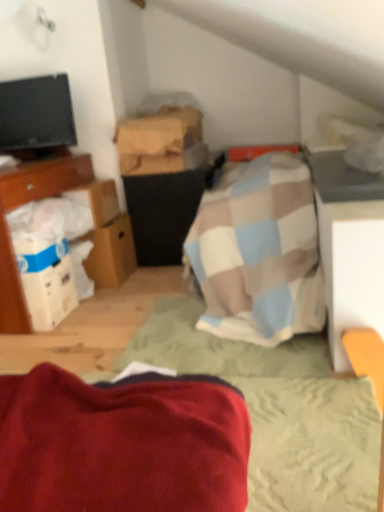
Question: Is white cardboard box at left with black glossy tv at upper left?

Choices:
 (A) yes
 (B) no

Answer: (B)

Question: Does white cardboard box at left have a larger size compared to black glossy tv at upper left?

Choices:
 (A) no
 (B) yes

Answer: (A)

Question: From a real-world perspective, is white cardboard box at left below black glossy tv at upper left?

Choices:
 (A) yes
 (B) no

Answer: (A)

Question: Considering the relative positions of white cardboard box at left and black glossy tv at upper left in the image provided, is white cardboard box at left in front of black glossy tv at upper left?

Choices:
 (A) no
 (B) yes

Answer: (B)

Question: Could you tell me if white cardboard box at left is facing black glossy tv at upper left?

Choices:
 (A) yes
 (B) no

Answer: (B)

Question: From a real-world perspective, does white cardboard box at left stand above black glossy tv at upper left?

Choices:
 (A) no
 (B) yes

Answer: (A)

Question: Does brown cardboard box at left, which is counted as the 2th cardboard box, starting from the bottom, have a larger size compared to white cardboard box at left?

Choices:
 (A) yes
 (B) no

Answer: (B)

Question: Is brown cardboard box at left, acting as the 2th cardboard box starting from the top, further to camera compared to white cardboard box at left?

Choices:
 (A) yes
 (B) no

Answer: (A)

Question: Is brown cardboard box at left, acting as the 2th cardboard box starting from the top, aimed at white cardboard box at left?

Choices:
 (A) yes
 (B) no

Answer: (B)

Question: From the image's perspective, is brown cardboard box at left, acting as the 2th cardboard box starting from the top, on white cardboard box at left?

Choices:
 (A) no
 (B) yes

Answer: (B)

Question: Does brown cardboard box at left, acting as the 2th cardboard box starting from the top, have a greater height compared to white cardboard box at left?

Choices:
 (A) no
 (B) yes

Answer: (A)

Question: From a real-world perspective, is brown cardboard box at left, acting as the 2th cardboard box starting from the top, positioned under white cardboard box at left based on gravity?

Choices:
 (A) yes
 (B) no

Answer: (B)

Question: Does white cardboard box at center-left, positioned as the 3th cardboard box in top-to-bottom order, appear on the right side of black glossy tv at upper left?

Choices:
 (A) no
 (B) yes

Answer: (B)